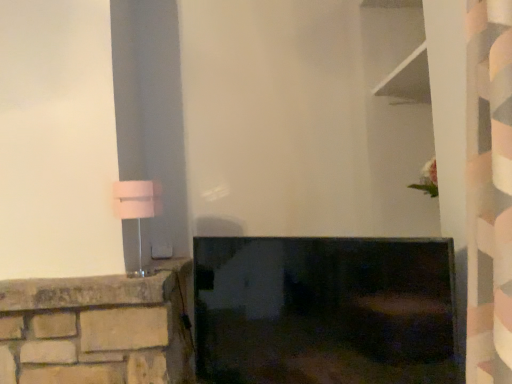
Question: Is pink fabric lampshade at left outside matte black tv at center?

Choices:
 (A) no
 (B) yes

Answer: (B)

Question: Does pink fabric lampshade at left have a lesser height compared to matte black tv at center?

Choices:
 (A) yes
 (B) no

Answer: (A)

Question: Would you say matte black tv at center is part of pink fabric lampshade at left's contents?

Choices:
 (A) no
 (B) yes

Answer: (A)

Question: Is pink fabric lampshade at left to the left of matte black tv at center from the viewer's perspective?

Choices:
 (A) no
 (B) yes

Answer: (B)

Question: Is pink fabric lampshade at left touching matte black tv at center?

Choices:
 (A) yes
 (B) no

Answer: (B)

Question: Could you tell me if pink fabric lampshade at left is facing matte black tv at center?

Choices:
 (A) yes
 (B) no

Answer: (B)

Question: Is matte black tv at center at the right side of pink fabric lampshade at left?

Choices:
 (A) yes
 (B) no

Answer: (A)

Question: From a real-world perspective, is matte black tv at center on top of pink fabric lampshade at left?

Choices:
 (A) no
 (B) yes

Answer: (A)

Question: Is matte black tv at center with pink fabric lampshade at left?

Choices:
 (A) yes
 (B) no

Answer: (B)

Question: Is matte black tv at center taller than pink fabric lampshade at left?

Choices:
 (A) no
 (B) yes

Answer: (B)

Question: Does matte black tv at center have a lesser width compared to pink fabric lampshade at left?

Choices:
 (A) no
 (B) yes

Answer: (B)

Question: Is the depth of matte black tv at center greater than that of pink fabric lampshade at left?

Choices:
 (A) yes
 (B) no

Answer: (B)

Question: In the image, is pink fabric lampshade at left positioned in front of or behind matte black tv at center?

Choices:
 (A) behind
 (B) front

Answer: (A)